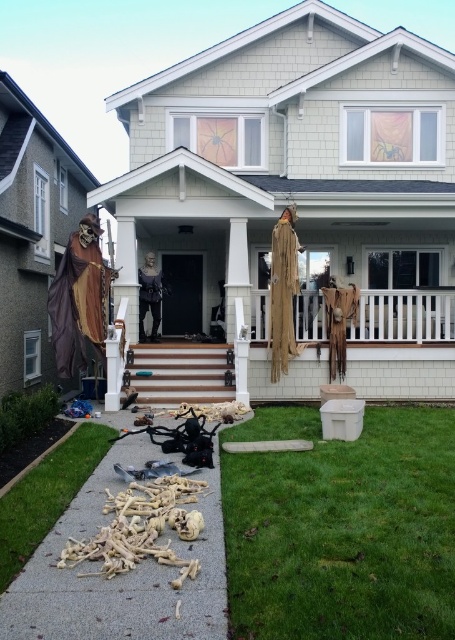
You are standing on the front porch of the Halloween house and want to place a new decoration. You have two points marked on the ground where you can place it. Which point is closer to you, point (x=1, y=547) or point (x=166, y=349)?

Point (x=1, y=547) is closer to the viewer than point (x=166, y=349), so you should place the decoration there if you want it closer to the entrance.

You are standing at the front entrance of the house and want to place a small pumpkin decoration. The pumpkin has a diameter of 15 cm. The green grass at lower center is located at point 0.825, 0.752. Can you place the pumpkin there without it overlapping with any other objects?

Yes, the green grass at lower center is at point (342, 528), so placing the pumpkin there would not overlap with other objects since the grass is clear at that location.